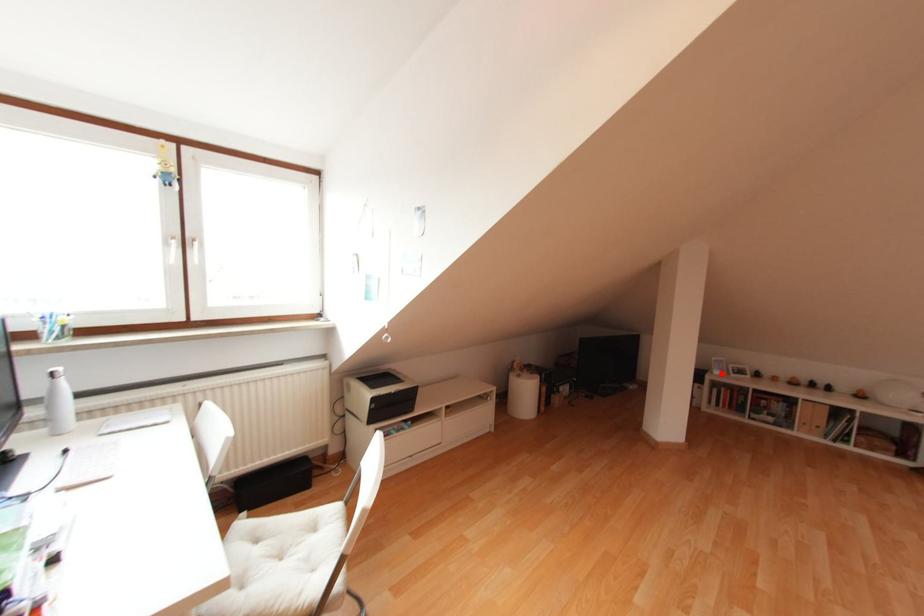
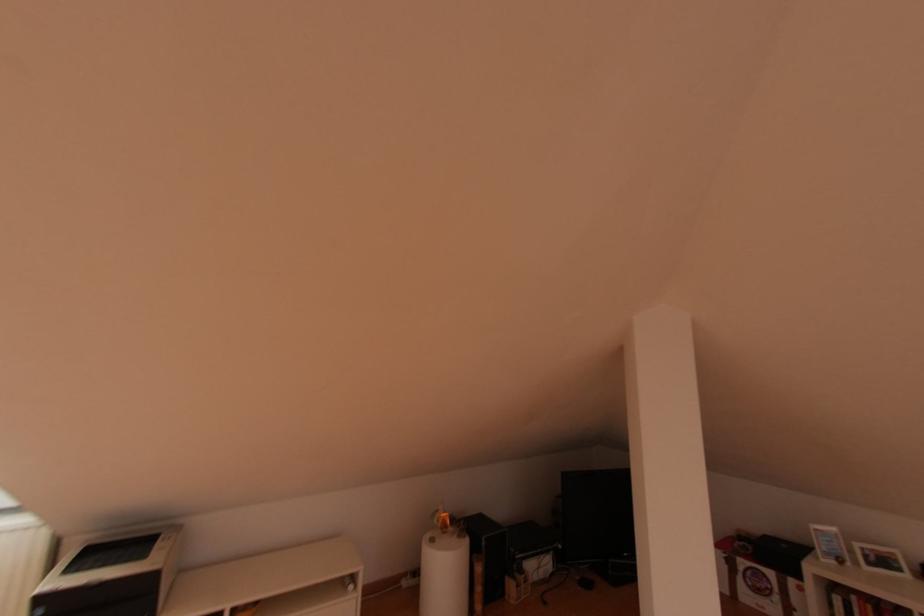
Find the pixel in the second image that matches the highlighted location in the first image.

(840, 562)